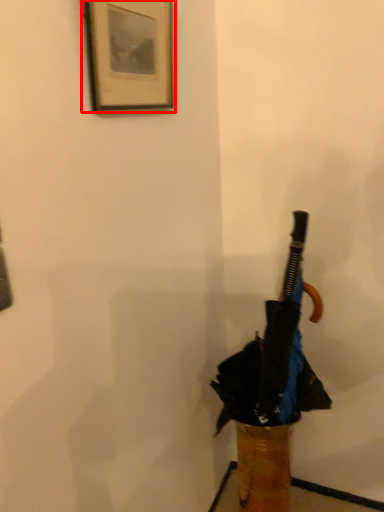
Question: From the image's perspective, what is the correct spatial relationship of picture frame (annotated by the red box) in relation to umbrella?

Choices:
 (A) below
 (B) above

Answer: (B)